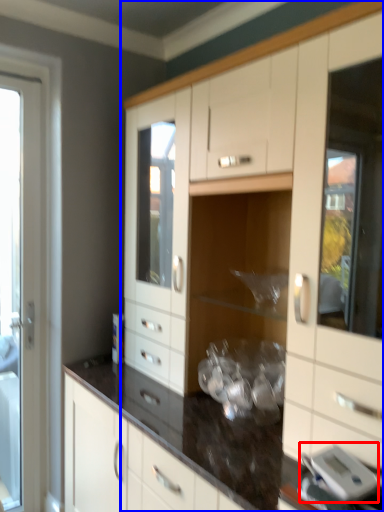
Question: Which of the following is the closest to the observer, appliance (highlighted by a red box) or cabinetry (highlighted by a blue box)?

Choices:
 (A) appliance
 (B) cabinetry

Answer: (B)